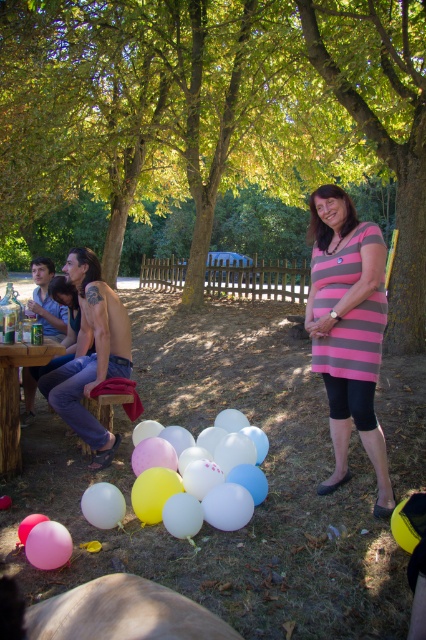
Question: Does green leafy tree at upper center have a smaller size compared to pastel balloons at lower center?

Choices:
 (A) no
 (B) yes

Answer: (A)

Question: From the image, what is the correct spatial relationship of pink rubber balloon at lower left in relation to white matte balloon at lower left?

Choices:
 (A) left
 (B) right

Answer: (A)

Question: Which is farther from the wooden picnic table at lower left?

Choices:
 (A) pastel balloons at lower center
 (B) pink rubber balloon at lower left

Answer: (B)

Question: Which of the following is the closest to the observer?

Choices:
 (A) (348, 321)
 (B) (121, 396)

Answer: (A)

Question: Which object appears closest to the camera in this image?

Choices:
 (A) green leafy tree at upper center
 (B) pink striped dress at center
 (C) pastel balloons at lower center

Answer: (C)

Question: Is wooden picnic table at lower left below pink rubber balloon at lower left?

Choices:
 (A) no
 (B) yes

Answer: (A)